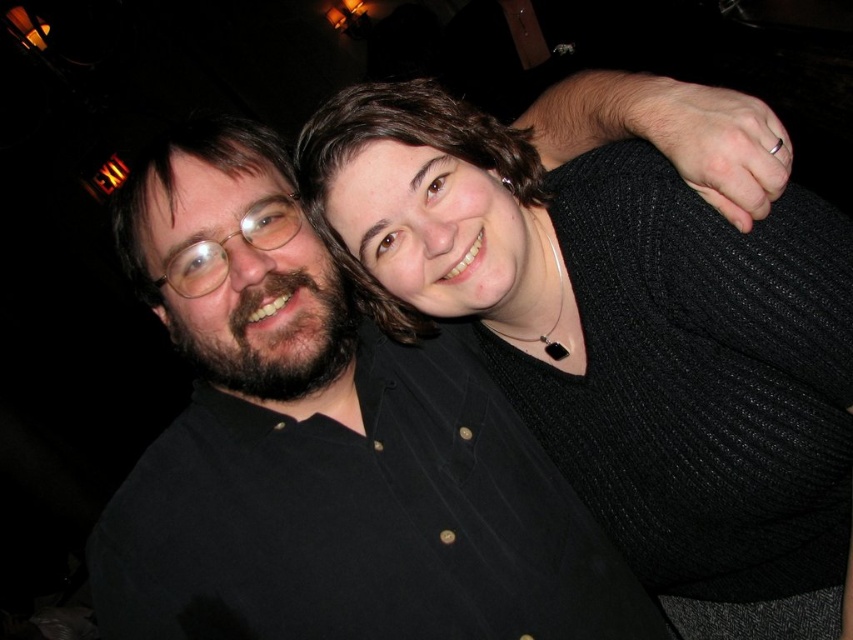
You are a photographer trying to decide which clothing item to focus on for a closeup shot. Since you want to capture the texture details clearly, which item between the black knitted sweater at upper right and the black matte shirt at center would you choose?

The black knitted sweater at upper right has a smaller width compared to the black matte shirt at center, so focusing on the black knitted sweater at upper right would allow for clearer texture details in the closeup shot.

Looking at this image, you are a photographer trying to adjust the lighting for a portrait. You notice the black knitted sweater at upper right and the black matte shirt at center. Which object is closer to the camera?

The black knitted sweater at upper right is closer to the camera since it is in front of the black matte shirt at center.

You are taking a photo of two people standing in a dimly lit room. You notice two points in the image labeled as point (439, 269) and point (271, 310). Which of these points is nearer to you?

Point (439, 269) is closer to the viewer than point (271, 310).